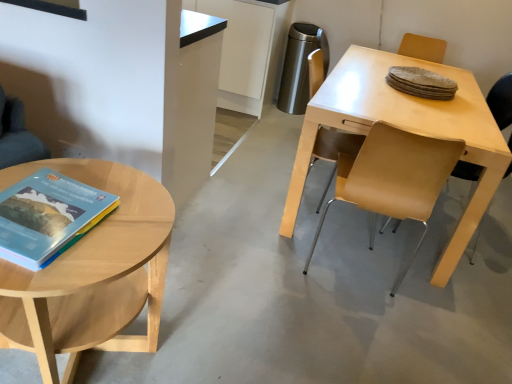
The height and width of the screenshot is (384, 512). What are the coordinates of `vacant space to the left of light brown leather chair at center, the first chair from the left` in the screenshot? It's located at (234, 209).